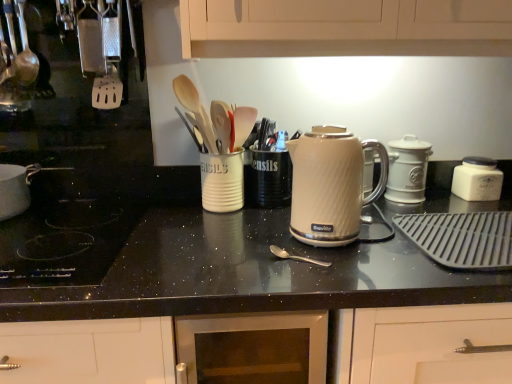
What do you see at coordinates (222, 182) in the screenshot? Image resolution: width=512 pixels, height=384 pixels. I see `white ribbed mug at center` at bounding box center [222, 182].

Describe the element at coordinates (477, 179) in the screenshot. This screenshot has width=512, height=384. I see `white ceramic container at right, arranged as the 3th kitchen appliance when viewed from the front` at that location.

Image resolution: width=512 pixels, height=384 pixels. What do you see at coordinates (331, 185) in the screenshot?
I see `cream matte electric kettle at center, the third kitchen appliance in the right-to-left sequence` at bounding box center [331, 185].

Identify the location of silver metallic spoon at center, the first utensil when ordered from front to back. This screenshot has width=512, height=384. (295, 256).

What is the approximate width of silver metallic spoon at center, which appears as the 1th utensil when ordered from the bottom?

The width of silver metallic spoon at center, which appears as the 1th utensil when ordered from the bottom, is 2.86 inches.

Describe the element at coordinates (109, 59) in the screenshot. The width and height of the screenshot is (512, 384). I see `white plastic spatula at left` at that location.

The width and height of the screenshot is (512, 384). Describe the element at coordinates (407, 169) in the screenshot. I see `white matte canister at right, which is counted as the 2th kitchen appliance, starting from the right` at that location.

Identify the location of white matte canister at right, which is the 2th kitchen appliance from left to right. (407, 169).

The height and width of the screenshot is (384, 512). In order to click on black granite countertop at center in this screenshot , I will do `click(224, 260)`.

Identify the location of white ribbed mug at center. (222, 182).

How different are the orientations of white ribbed mug at center and black granite countertop at center in degrees?

white ribbed mug at center and black granite countertop at center are facing 1.62 degrees away from each other.

From the image's perspective, is white ribbed mug at center under black granite countertop at center?

Actually, white ribbed mug at center appears above black granite countertop at center in the image.

Which is behind, point (221, 160) or point (238, 242)?

The point (221, 160) is more distant.

Does white ribbed mug at center have a greater width compared to black granite countertop at center?

In fact, white ribbed mug at center might be narrower than black granite countertop at center.

Does point (21, 41) appear closer or farther from the camera than point (229, 156)?

Clearly, point (21, 41) is more distant from the camera than point (229, 156).

How different are the orientations of brushed metal spoon at upper left, which is counted as the first utensil, starting from the back, and white ribbed mug at center in degrees?

There is a 1.21-degree angle between the facing directions of brushed metal spoon at upper left, which is counted as the first utensil, starting from the back, and white ribbed mug at center.

Is brushed metal spoon at upper left, acting as the 2th utensil starting from the right, to the right of white ribbed mug at center from the viewer's perspective?

In fact, brushed metal spoon at upper left, acting as the 2th utensil starting from the right, is to the left of white ribbed mug at center.

Between brushed metal spoon at upper left, the 1th utensil viewed from the top, and white ribbed mug at center, which one has larger width?

white ribbed mug at center.

Could you tell me if black granite countertop at center is turned towards white ribbed mug at center?

No.

From the image's perspective, is black granite countertop at center located above white ribbed mug at center?

Actually, black granite countertop at center appears below white ribbed mug at center in the image.

Is black granite countertop at center taller or shorter than white ribbed mug at center?

black granite countertop at center is taller than white ribbed mug at center.

Does black granite countertop at center appear on the left side of white ribbed mug at center?

Incorrect, black granite countertop at center is not on the left side of white ribbed mug at center.

Is cream matte electric kettle at center, the third kitchen appliance in the right-to-left sequence, oriented towards black granite countertop at center?

No, cream matte electric kettle at center, the third kitchen appliance in the right-to-left sequence, is not turned towards black granite countertop at center.

What's the angular difference between cream matte electric kettle at center, which is counted as the first kitchen appliance, starting from the left, and black granite countertop at center's facing directions?

The angular difference between cream matte electric kettle at center, which is counted as the first kitchen appliance, starting from the left, and black granite countertop at center is 0.964 degrees.

From the image's perspective, who appears lower, cream matte electric kettle at center, which is counted as the first kitchen appliance, starting from the left, or black granite countertop at center?

black granite countertop at center appears lower in the image.

Which is correct: cream matte electric kettle at center, the third kitchen appliance in the right-to-left sequence, is inside black granite countertop at center, or outside of it?

cream matte electric kettle at center, the third kitchen appliance in the right-to-left sequence, is not inside black granite countertop at center, it's outside.

How far apart are white plastic spatula at left and cream matte electric kettle at center, arranged as the 3th kitchen appliance when viewed from the back?

white plastic spatula at left and cream matte electric kettle at center, arranged as the 3th kitchen appliance when viewed from the back, are 64.21 centimeters apart from each other.

Locate an element on the screen. The width and height of the screenshot is (512, 384). kitchen appliance located in front of the white plastic spatula at left is located at coordinates [331, 185].

Between point (94, 87) and point (293, 213), which one is positioned behind?

The point (94, 87) is behind.

Does white plastic spatula at left have a smaller size compared to cream matte electric kettle at center, which is counted as the first kitchen appliance, starting from the left?

Correct, white plastic spatula at left occupies less space than cream matte electric kettle at center, which is counted as the first kitchen appliance, starting from the left.

At what (x,y) coordinates should I click in order to perform the action: click on the 2nd kitchen appliance directly beneath the brushed metal spoon at upper left, which ranks as the 2th utensil in bottom-to-top order (from a real-world perspective). Please return your answer as a coordinate pair (x, y). Looking at the image, I should click on (407, 169).

From the image's perspective, which one is positioned higher, white matte canister at right, which is counted as the 2th kitchen appliance, starting from the right, or brushed metal spoon at upper left, which appears as the second utensil when viewed from the front?

brushed metal spoon at upper left, which appears as the second utensil when viewed from the front.

How far apart are white matte canister at right, the second kitchen appliance in the back-to-front sequence, and brushed metal spoon at upper left, which appears as the second utensil when viewed from the front?

They are 3.49 feet apart.

From a real-world perspective, is white matte canister at right, the second kitchen appliance in the back-to-front sequence, physically below brushed metal spoon at upper left, the 1th utensil viewed from the top?

Yes, from a real-world perspective, white matte canister at right, the second kitchen appliance in the back-to-front sequence, is beneath brushed metal spoon at upper left, the 1th utensil viewed from the top.

Is point (204, 209) closer to camera compared to point (321, 262)?

No, (204, 209) is behind (321, 262).

Does white ribbed mug at center turn towards silver metallic spoon at center, which appears as the 1th utensil when ordered from the bottom?

Yes, white ribbed mug at center is facing silver metallic spoon at center, which appears as the 1th utensil when ordered from the bottom.

In the scene shown: Considering the relative sizes of white ribbed mug at center and silver metallic spoon at center, which is the first utensil from right to left, in the image provided, is white ribbed mug at center wider than silver metallic spoon at center, which is the first utensil from right to left,?

Yes, white ribbed mug at center is wider than silver metallic spoon at center, which is the first utensil from right to left.

Locate an element on the screen. countertop below the white ribbed mug at center (from a real-world perspective) is located at coordinates (224, 260).

You are a GUI agent. You are given a task and a screenshot of the screen. Output one action in this format:
    pyautogui.click(x=<x>, y=<y>)
    Task: Click on the mug that appears below the brushed metal spoon at upper left, which is counted as the first utensil, starting from the back (from the image's perspective)
    The image size is (512, 384).
    Given the screenshot: What is the action you would take?
    tap(222, 182)

Considering their positions, is white matte canister at right, which is counted as the 2th kitchen appliance, starting from the right, positioned further to white plastic spatula at left than silver metallic spoon at center, the 2th utensil when ordered from left to right?

white matte canister at right, which is counted as the 2th kitchen appliance, starting from the right, is positioned further to the anchor white plastic spatula at left.

Looking at the image, which one is located further to white ceramic container at right, arranged as the 3th kitchen appliance when viewed from the front, silver metallic spoon at center, which is the first utensil from right to left, or brushed metal spoon at upper left, which appears as the second utensil when viewed from the front?

brushed metal spoon at upper left, which appears as the second utensil when viewed from the front, lies further to white ceramic container at right, arranged as the 3th kitchen appliance when viewed from the front, than the other object.

Estimate the real-world distances between objects in this image. Which object is further from white ribbed mug at center, silver metallic spoon at center, the 2th utensil when ordered from left to right, or white ceramic container at right, the third kitchen appliance viewed from the left?

The object further to white ribbed mug at center is white ceramic container at right, the third kitchen appliance viewed from the left.

Based on their spatial positions, is cream matte electric kettle at center, the third kitchen appliance in the right-to-left sequence, or white matte canister at right, which is counted as the 2th kitchen appliance, starting from the right, further from black granite countertop at center?

white matte canister at right, which is counted as the 2th kitchen appliance, starting from the right, lies further to black granite countertop at center than the other object.

From the image, which object appears to be farther from cream matte electric kettle at center, the third kitchen appliance in the right-to-left sequence, white ribbed mug at center or black granite countertop at center?

The object further to cream matte electric kettle at center, the third kitchen appliance in the right-to-left sequence, is white ribbed mug at center.

When comparing their distances from white matte canister at right, which ranks as the second kitchen appliance in front-to-back order, does black glass cooktop at lower left or silver metallic spoon at center, which ranks as the 2th utensil in top-to-bottom order, seem further?

black glass cooktop at lower left.

Based on their spatial positions, is white ribbed mug at center or white plastic spatula at left further from black glass cooktop at lower left?

Based on the image, white plastic spatula at left appears to be further to black glass cooktop at lower left.

From the image, which object appears to be farther from white ceramic container at right, positioned as the first kitchen appliance in back-to-front order, cream matte electric kettle at center, arranged as the 3th kitchen appliance when viewed from the back, or brushed metal spoon at upper left, acting as the 2th utensil starting from the right?

brushed metal spoon at upper left, acting as the 2th utensil starting from the right, is positioned further to the anchor white ceramic container at right, positioned as the first kitchen appliance in back-to-front order.

Where is `utensil situated between black glass cooktop at lower left and white ceramic container at right, the third kitchen appliance viewed from the left, from left to right`? The width and height of the screenshot is (512, 384). utensil situated between black glass cooktop at lower left and white ceramic container at right, the third kitchen appliance viewed from the left, from left to right is located at coordinates (295, 256).

This screenshot has height=384, width=512. Identify the location of countertop located between white plastic spatula at left and white matte canister at right, the second kitchen appliance in the back-to-front sequence, in the left-right direction. (224, 260).

The image size is (512, 384). Identify the location of utensil situated between white ribbed mug at center and white matte canister at right, which ranks as the second kitchen appliance in front-to-back order, from left to right. click(x=295, y=256).

Identify the location of mug situated between brushed metal spoon at upper left, which is counted as the first utensil, starting from the back, and cream matte electric kettle at center, which is counted as the first kitchen appliance, starting from the left, from left to right. (222, 182).